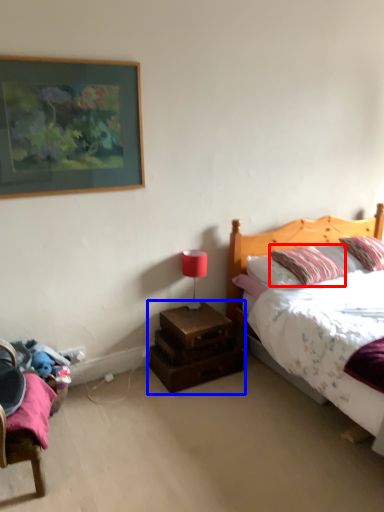
Question: Which of the following is the closest to the observer, pillow (highlighted by a red box) or nightstand (highlighted by a blue box)?

Choices:
 (A) pillow
 (B) nightstand

Answer: (A)